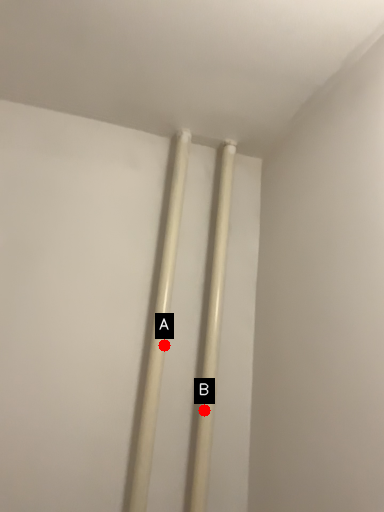
Question: Two points are circled on the image, labeled by A and B beside each circle. Which point is closer to the camera?

Choices:
 (A) A is closer
 (B) B is closer

Answer: (B)